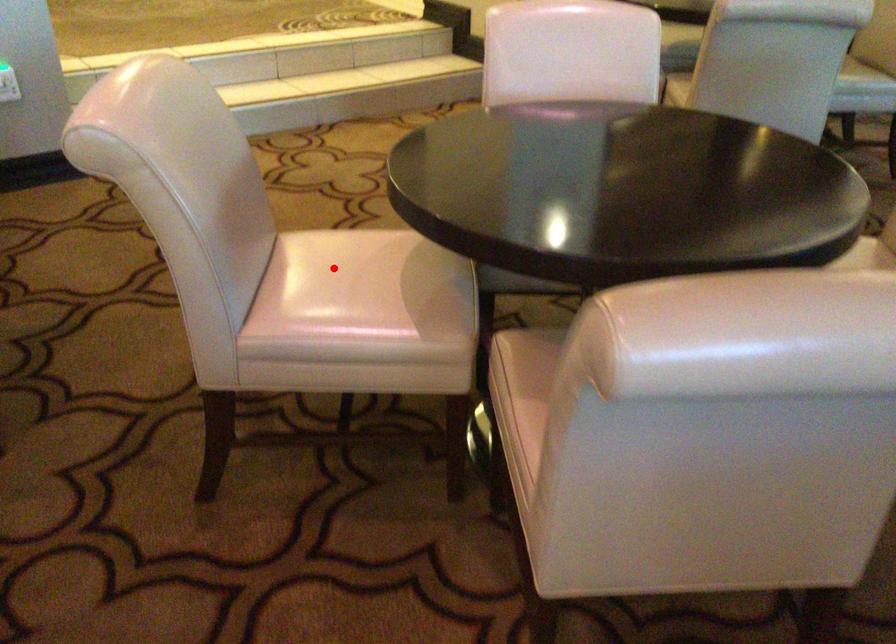
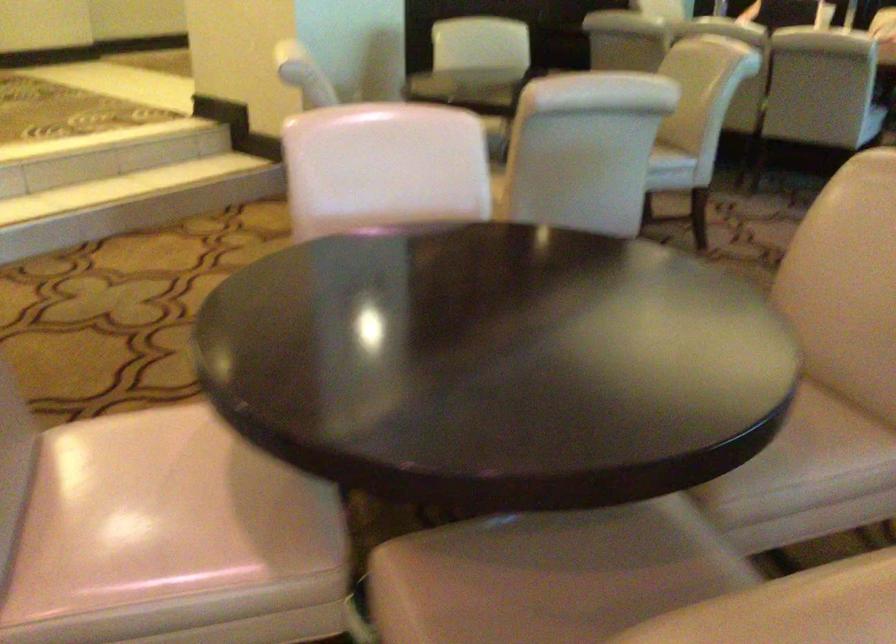
Locate, in the second image, the point that corresponds to the highlighted location in the first image.

(135, 476)